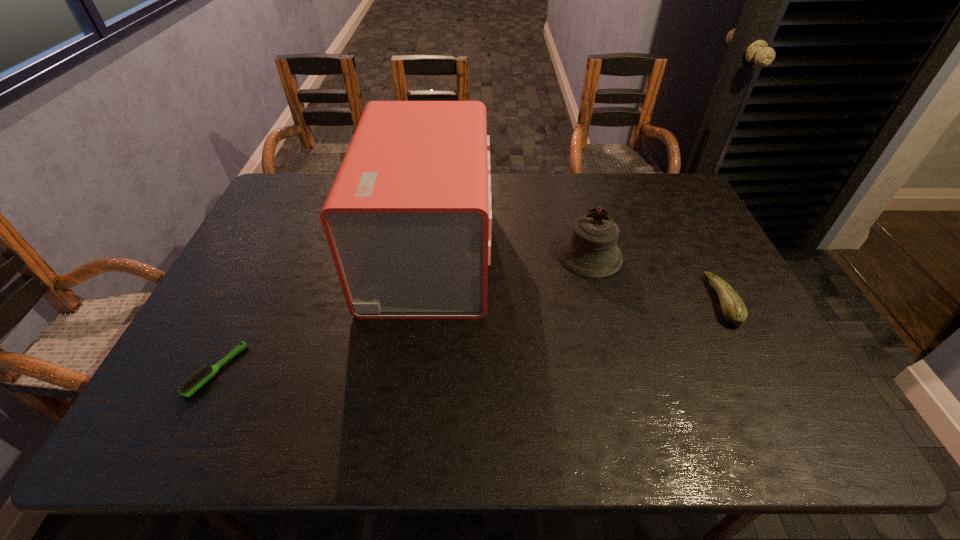
The height and width of the screenshot is (540, 960). Find the location of `the third object from right to left`. the third object from right to left is located at coordinates (408, 220).

At what (x,y) coordinates should I click in order to perform the action: click on box. Please return your answer as a coordinate pair (x, y). This screenshot has height=540, width=960. Looking at the image, I should click on (408, 220).

I want to click on the third shortest object, so click(591, 251).

This screenshot has width=960, height=540. I want to click on bell, so click(x=591, y=251).

Where is `the second shortest object`? the second shortest object is located at coordinates (734, 310).

What are the coordinates of `zucchini` in the screenshot? It's located at (734, 310).

The width and height of the screenshot is (960, 540). What are the coordinates of `the nearest object` in the screenshot? It's located at (194, 382).

Where is `the leftmost object`? the leftmost object is located at coordinates click(x=194, y=382).

Identify the location of vacant point located 0.160m on the surface of the tallest object where the text is embossed. (542, 252).

This screenshot has width=960, height=540. Identify the location of vacant position located on the back of the second object from right to left. pos(575,199).